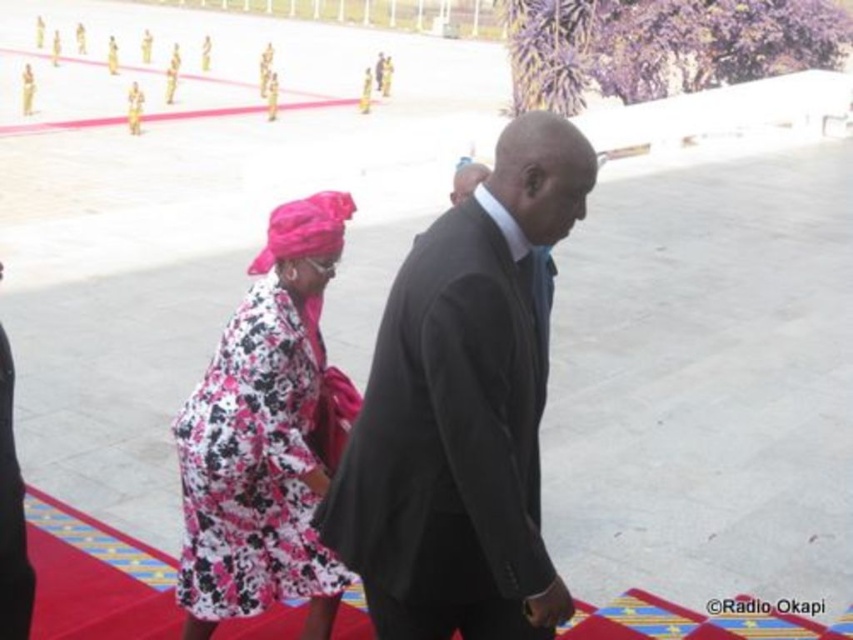
Where is the dark gray suit at center located in the image?

A: The dark gray suit at center is located at point 0.644 on the x axis and 0.543 on the y axis.

You are standing at the point marked by the coordinates point (x=462, y=412) in the image. What object is directly in front of you?

The point (x=462, y=412) indicates dark gray suit at center, so the dark gray suit at center is directly in front of you.

You are a photographer at the event and need to ensure both the dark gray suit at center and the floral fabric dress at center are fully visible in the frame. Given that the camera can only capture a width of 1.2 meters, can both be accommodated without cropping?

The dark gray suit at center is wider than the floral fabric dress at center. Since the camera can only capture 1.2 meters, and the total width of both items combined would exceed this limit, they cannot both be accommodated without cropping.